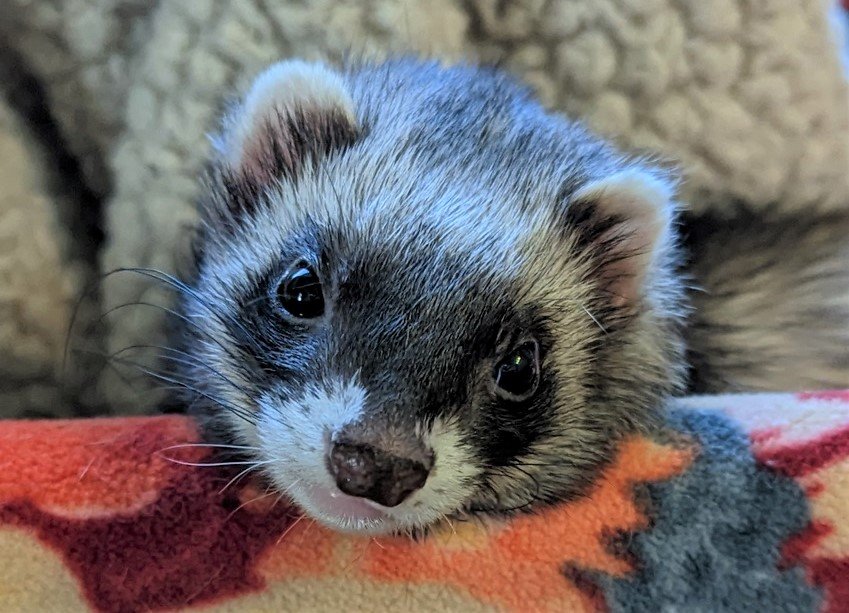
Identify the location of blanket. This screenshot has height=613, width=849. (323, 544).